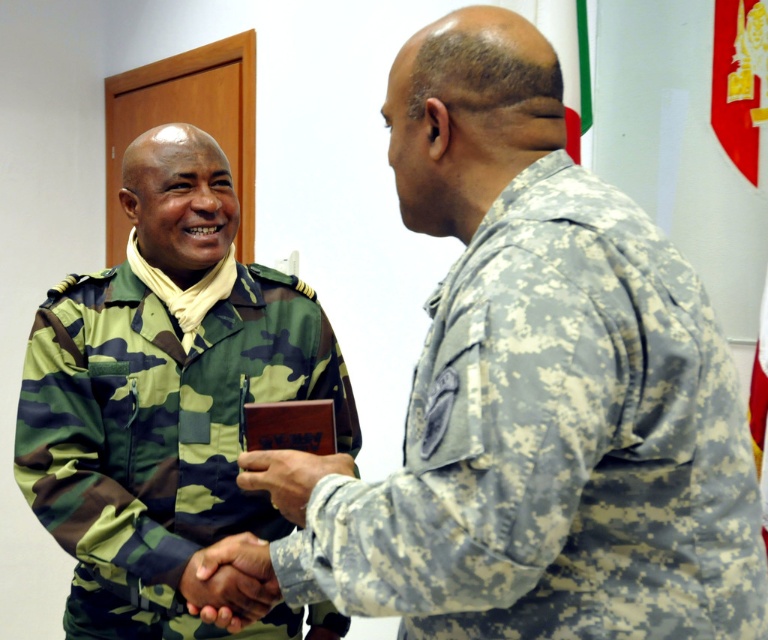
Does point (497, 381) come in front of point (127, 474)?

Yes, it is in front of point (127, 474).

Describe the element at coordinates (554, 444) in the screenshot. I see `camouflage fabric uniform at right` at that location.

Find the location of a particular element. camouflage fabric uniform at right is located at coordinates (554, 444).

Between point (265, 392) and point (217, 600), which one is positioned in front?

Point (217, 600)

Between camo fabric uniform at left and dark skin textured hand at center, which one has more height?

With more height is camo fabric uniform at left.

This screenshot has width=768, height=640. In order to click on camo fabric uniform at left in this screenshot , I will do click(159, 432).

Between camouflage fabric uniform at right and dark skin textured hand at center, which one appears on the left side from the viewer's perspective?

dark skin textured hand at center

Is camouflage fabric uniform at right to the right of dark skin textured hand at center from the viewer's perspective?

Indeed, camouflage fabric uniform at right is positioned on the right side of dark skin textured hand at center.

Image resolution: width=768 pixels, height=640 pixels. Describe the element at coordinates (554, 444) in the screenshot. I see `camouflage fabric uniform at right` at that location.

Identify the location of camouflage fabric uniform at right. (554, 444).